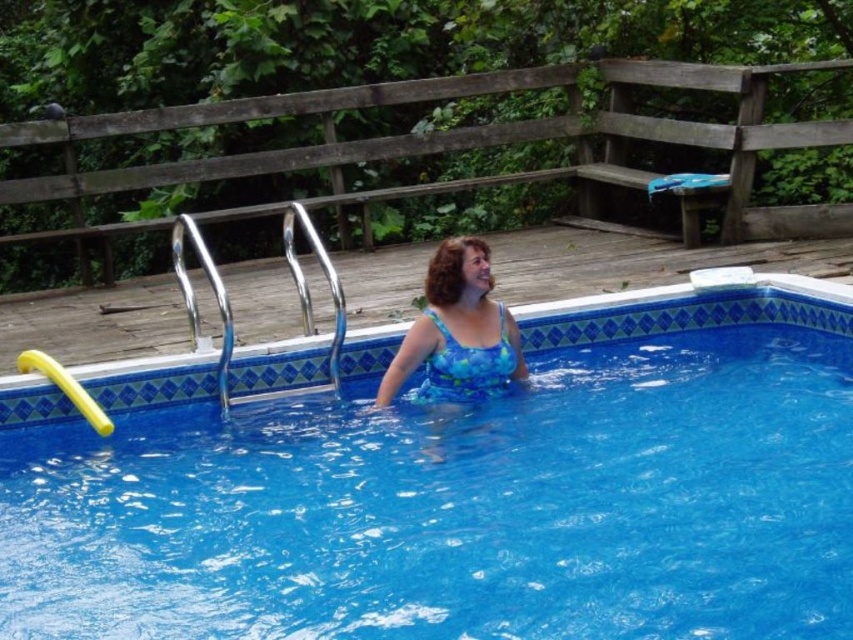
You are a lifeguard observing the pool from the edge. You notice the blue glossy water at center and the blue printed swimsuit at center. Which object is closer to you?

The blue glossy water at center is closer to you because it is in front of the blue printed swimsuit at center.

You are a lifeguard who needs to ensure safety. You see the blue glossy water at center and the blue printed swimsuit at center in the pool. Which object is wider?

The blue glossy water at center is wider than the blue printed swimsuit at center.